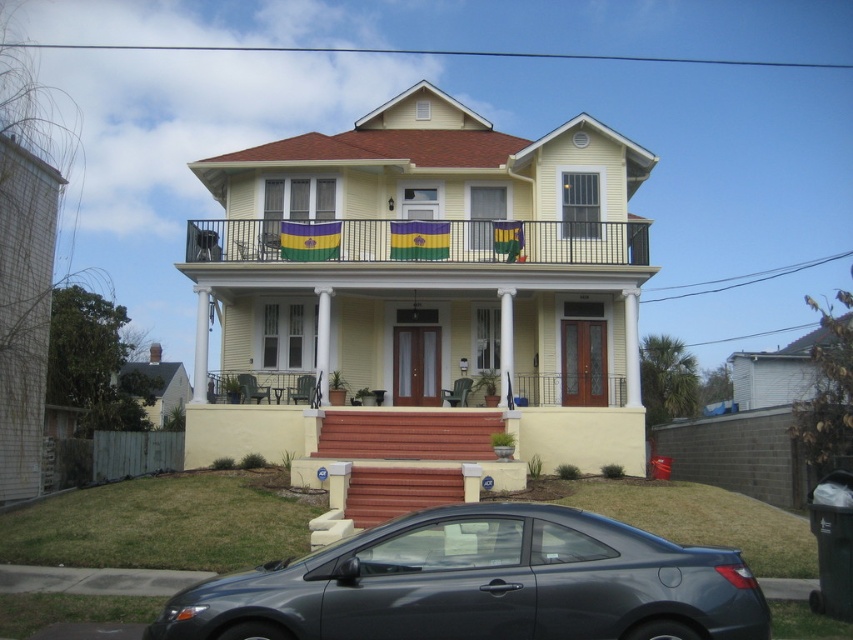
Looking at this image, you are a delivery person approaching the house and need to park your vehicle, the satin black car at lower center, near the entrance without blocking the view of the metallic wrought iron balcony at upper center. Can you park the car in a way that keeps the balcony visible from the street?

The satin black car at lower center is currently in front of the metallic wrought iron balcony at upper center, so if parked there it would block the balcony view. To keep the balcony visible, park the car to the side of the entrance instead of directly in front.